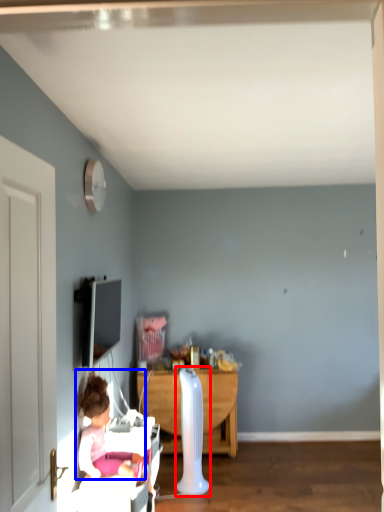
Question: Which of the following is the farthest to the observer, radiator (highlighted by a red box) or person (highlighted by a blue box)?

Choices:
 (A) radiator
 (B) person

Answer: (A)